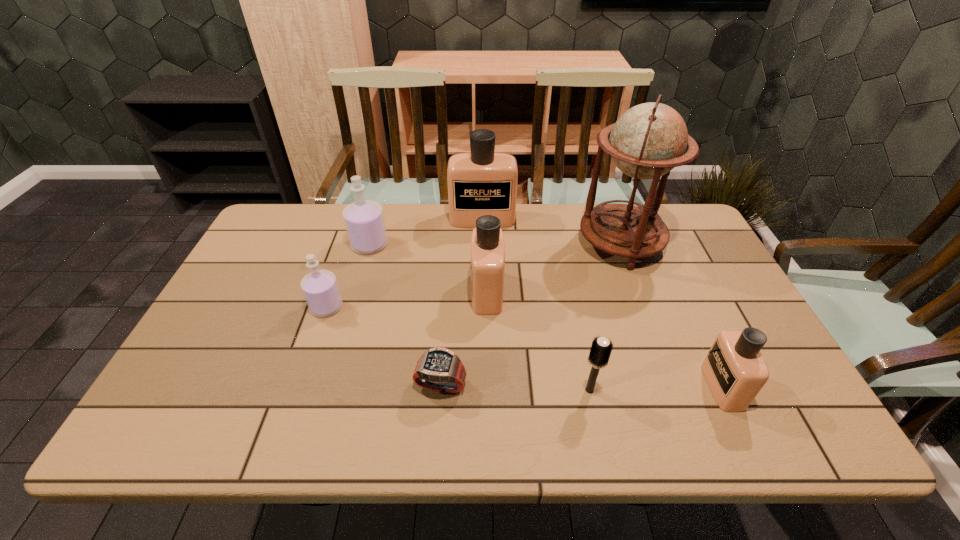
Locate an element on the screen. Image resolution: width=960 pixels, height=540 pixels. object present at the far right corner is located at coordinates (650, 139).

This screenshot has width=960, height=540. I want to click on object that is at the near right corner, so click(735, 371).

Find the location of `vacant space at the far edge of the desktop`. vacant space at the far edge of the desktop is located at coordinates (416, 213).

Where is `vacant space at the near edge of the desktop`? The width and height of the screenshot is (960, 540). vacant space at the near edge of the desktop is located at coordinates (454, 434).

The height and width of the screenshot is (540, 960). Find the location of `free space at the right edge of the desktop`. free space at the right edge of the desktop is located at coordinates (709, 293).

In the image, there is a desktop. Where is `vacant space at the near left corner`? This screenshot has width=960, height=540. vacant space at the near left corner is located at coordinates (212, 414).

The width and height of the screenshot is (960, 540). What are the coordinates of `vacant area that lies between the rightmost beige perfume and the second farthest perfume` in the screenshot? It's located at (546, 315).

Where is `free space between the fourth nearest perfume and the rightmost perfume`? Image resolution: width=960 pixels, height=540 pixels. free space between the fourth nearest perfume and the rightmost perfume is located at coordinates (546, 315).

Identify the location of free space between the nearer purple perfume and the red watch. The height and width of the screenshot is (540, 960). (384, 346).

In order to click on free point between the second nearest beige perfume and the globe in this screenshot , I will do `click(554, 268)`.